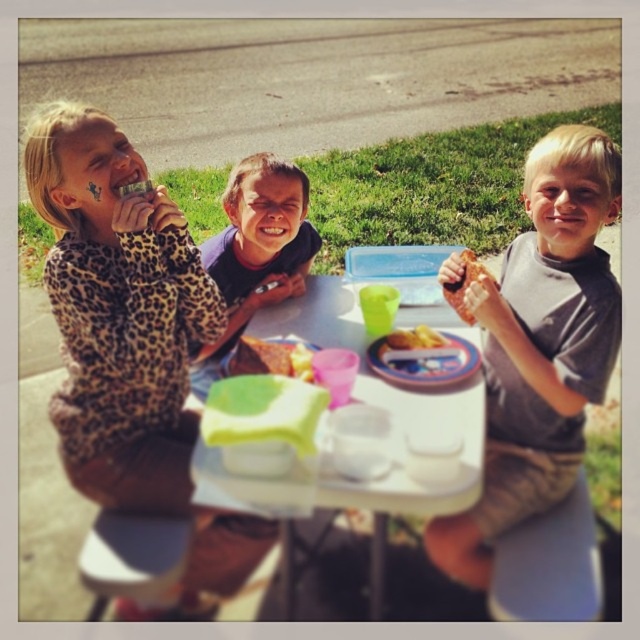
You are a parent trying to place a golden brown cake at center on the white plastic tray at center for your child. Can you fit the cake on the tray without moving any other items?

The white plastic tray at center and golden brown cake at center are 25.92 centimeters apart. Since the distance between them is quite large, you can easily place the cake on the tray without moving other items.